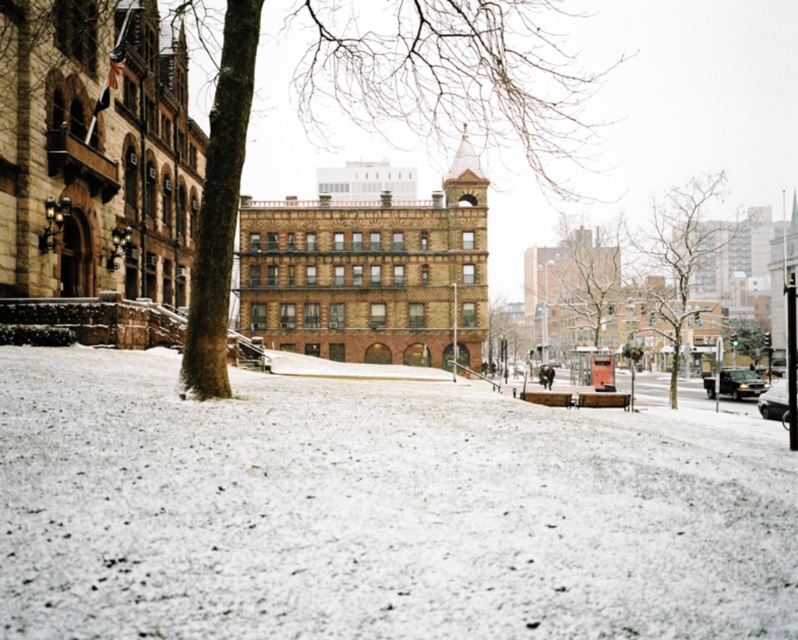
Question: Among these objects, which one is nearest to the camera?

Choices:
 (A) bare branches at center
 (B) smooth brown tree at center
 (C) white powdery snow at lower center

Answer: (C)

Question: Among these objects, which one is farthest from the camera?

Choices:
 (A) bare branches at center
 (B) white powdery snow at lower center

Answer: (A)

Question: Is white powdery snow at lower center to the right of smooth brown tree at center from the viewer's perspective?

Choices:
 (A) no
 (B) yes

Answer: (A)

Question: Can you confirm if smooth brown tree at center is bigger than bare branches at center?

Choices:
 (A) no
 (B) yes

Answer: (A)

Question: Which object is positioned closest to the smooth brown tree at center?

Choices:
 (A) white powdery snow at lower center
 (B) bare branches at center

Answer: (B)

Question: Does smooth brown tree at center appear over bare branches at center?

Choices:
 (A) no
 (B) yes

Answer: (A)